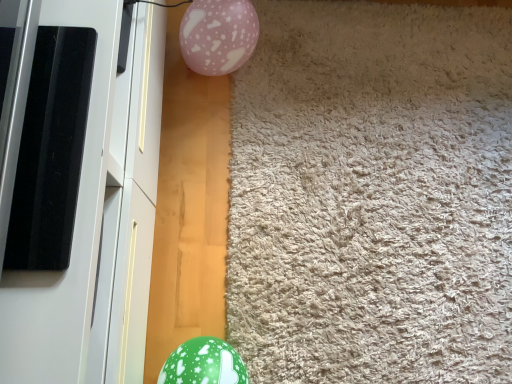
The height and width of the screenshot is (384, 512). What do you see at coordinates (218, 35) in the screenshot?
I see `pink glossy balloon at upper center` at bounding box center [218, 35].

This screenshot has width=512, height=384. I want to click on pink glossy balloon at upper center, so click(x=218, y=35).

Find the location of a particular element. white glossy screen door at left is located at coordinates (61, 193).

Is pink glossy balloon at upper center surrounded by green glossy balloon at lower left?

No, pink glossy balloon at upper center is not a part of green glossy balloon at lower left.

Between green glossy balloon at lower left and pink glossy balloon at upper center, which one has larger size?

With larger size is pink glossy balloon at upper center.

Is green glossy balloon at lower left positioned in front of pink glossy balloon at upper center?

Yes.

Between point (209, 338) and point (219, 13), which one is positioned behind?

Positioned behind is point (219, 13).

Which is closer, (237,378) or (85,140)?

Point (237,378) is positioned farther from the camera compared to point (85,140).

In the scene shown: Considering the sizes of green glossy balloon at lower left and white glossy screen door at left in the image, is green glossy balloon at lower left bigger or smaller than white glossy screen door at left?

Considering their sizes, green glossy balloon at lower left takes up less space than white glossy screen door at left.

Is green glossy balloon at lower left in front of or behind white glossy screen door at left in the image?

Clearly, green glossy balloon at lower left is behind white glossy screen door at left.

Image resolution: width=512 pixels, height=384 pixels. Identify the location of screen door lying below the pink glossy balloon at upper center (from the image's perspective). (61, 193).

From the picture: Who is shorter, pink glossy balloon at upper center or white glossy screen door at left?

pink glossy balloon at upper center is shorter.

Is there a large distance between pink glossy balloon at upper center and white glossy screen door at left?

Actually, pink glossy balloon at upper center and white glossy screen door at left are a little close together.

Does pink glossy balloon at upper center turn towards white glossy screen door at left?

No, pink glossy balloon at upper center is not turned towards white glossy screen door at left.

Considering the points (478, 244) and (221, 48), which point is in front, point (478, 244) or point (221, 48)?

The point (221, 48) is closer.

How many degrees apart are the facing directions of beige shaggy carpet at center and pink glossy balloon at upper center?

They differ by 92.3 degrees in their facing directions.

Would you say beige shaggy carpet at center is a long distance from pink glossy balloon at upper center?

That's not correct — beige shaggy carpet at center is a little close to pink glossy balloon at upper center.

Which object is further away from the camera taking this photo, beige shaggy carpet at center or pink glossy balloon at upper center?

pink glossy balloon at upper center.

Is beige shaggy carpet at center placed right next to white glossy screen door at left?

There is a gap between beige shaggy carpet at center and white glossy screen door at left.

Considering the relative sizes of beige shaggy carpet at center and white glossy screen door at left in the image provided, is beige shaggy carpet at center smaller than white glossy screen door at left?

Yes.

Identify the location of screen door on the left of the beige shaggy carpet at center. The width and height of the screenshot is (512, 384). point(61,193).

From the image's perspective, is beige shaggy carpet at center above or below white glossy screen door at left?

Clearly, from the image's perspective, beige shaggy carpet at center is below white glossy screen door at left.

From a real-world perspective, is white glossy screen door at left located beneath pink glossy balloon at upper center?

No, from a real-world perspective, white glossy screen door at left is not under pink glossy balloon at upper center.

Who is shorter, white glossy screen door at left or pink glossy balloon at upper center?

With less height is pink glossy balloon at upper center.

Can you confirm if white glossy screen door at left is thinner than pink glossy balloon at upper center?

Incorrect, the width of white glossy screen door at left is not less than that of pink glossy balloon at upper center.

Is white glossy screen door at left far away from pink glossy balloon at upper center?

No, there isn't a large distance between white glossy screen door at left and pink glossy balloon at upper center.

Is green glossy balloon at lower left aimed at beige shaggy carpet at center?

No, green glossy balloon at lower left does not turn towards beige shaggy carpet at center.

Considering the sizes of objects green glossy balloon at lower left and beige shaggy carpet at center in the image provided, who is wider, green glossy balloon at lower left or beige shaggy carpet at center?

beige shaggy carpet at center.

From a real-world perspective, is green glossy balloon at lower left beneath beige shaggy carpet at center?

No.

Considering the positions of objects green glossy balloon at lower left and beige shaggy carpet at center in the image provided, who is more to the left, green glossy balloon at lower left or beige shaggy carpet at center?

From the viewer's perspective, green glossy balloon at lower left appears more on the left side.

The height and width of the screenshot is (384, 512). In order to click on balloon behind the green glossy balloon at lower left in this screenshot , I will do `click(218, 35)`.

The image size is (512, 384). Find the location of `screen door lying on the left of green glossy balloon at lower left`. screen door lying on the left of green glossy balloon at lower left is located at coordinates 61,193.

In the scene shown: From the image, which object appears to be farther from pink glossy balloon at upper center, beige shaggy carpet at center or green glossy balloon at lower left?

The object further to pink glossy balloon at upper center is green glossy balloon at lower left.

Considering their positions, is beige shaggy carpet at center positioned closer to white glossy screen door at left than pink glossy balloon at upper center?

pink glossy balloon at upper center.

When comparing their distances from green glossy balloon at lower left, does pink glossy balloon at upper center or white glossy screen door at left seem further?

pink glossy balloon at upper center is positioned further to the anchor green glossy balloon at lower left.

Considering their positions, is green glossy balloon at lower left positioned further to white glossy screen door at left than pink glossy balloon at upper center?

Among the two, pink glossy balloon at upper center is located further to white glossy screen door at left.

Considering their positions, is white glossy screen door at left positioned further to pink glossy balloon at upper center than green glossy balloon at lower left?

Based on the image, green glossy balloon at lower left appears to be further to pink glossy balloon at upper center.

When comparing their distances from pink glossy balloon at upper center, does green glossy balloon at lower left or beige shaggy carpet at center seem further?

green glossy balloon at lower left.

Looking at this image, estimate the real-world distances between objects in this image. Which object is further from white glossy screen door at left, green glossy balloon at lower left or beige shaggy carpet at center?

Among the two, beige shaggy carpet at center is located further to white glossy screen door at left.

When comparing their distances from green glossy balloon at lower left, does beige shaggy carpet at center or pink glossy balloon at upper center seem closer?

beige shaggy carpet at center.

What are the coordinates of `balloon between white glossy screen door at left and beige shaggy carpet at center` in the screenshot? It's located at (218, 35).

Find the location of a particular element. mat between pink glossy balloon at upper center and green glossy balloon at lower left in the vertical direction is located at coordinates (372, 195).

Locate an element on the screen. Image resolution: width=512 pixels, height=384 pixels. egg between white glossy screen door at left and beige shaggy carpet at center is located at coordinates (204, 363).

Where is `screen door between pink glossy balloon at upper center and green glossy balloon at lower left vertically`? The width and height of the screenshot is (512, 384). screen door between pink glossy balloon at upper center and green glossy balloon at lower left vertically is located at coordinates (61, 193).